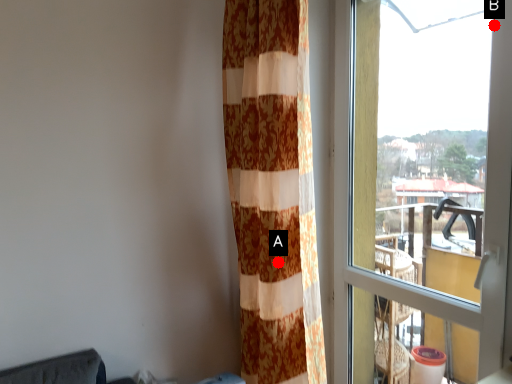
Question: Two points are circled on the image, labeled by A and B beside each circle. Which point is closer to the camera?

Choices:
 (A) A is closer
 (B) B is closer

Answer: (B)